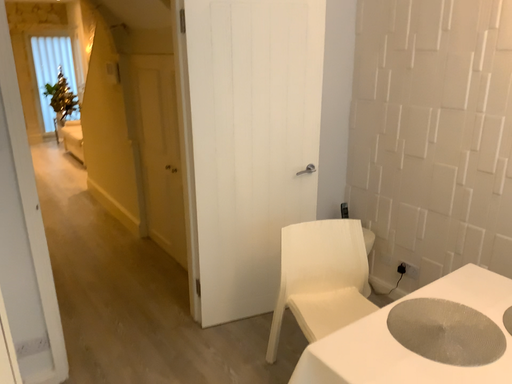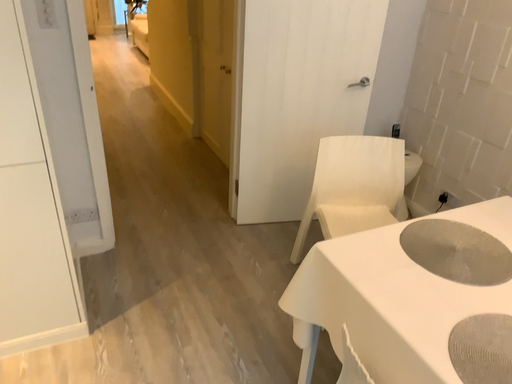
Question: Which way did the camera rotate in the video?

Choices:
 (A) rotated downward
 (B) rotated upward

Answer: (A)